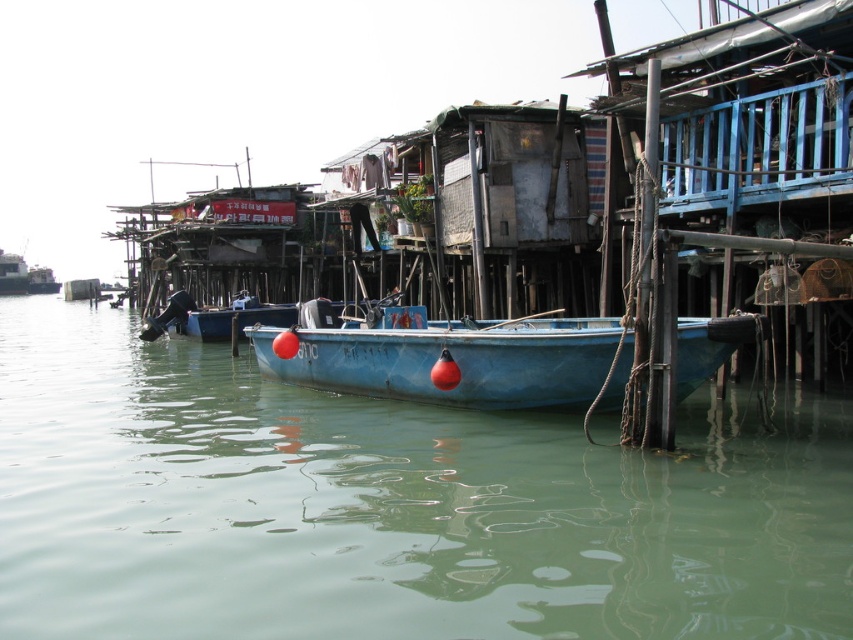
Question: Which object appears farthest from the camera in this image?

Choices:
 (A) green matte water at center
 (B) blue matte boat at center

Answer: (B)

Question: Which point is closer to the camera taking this photo?

Choices:
 (A) (685, 360)
 (B) (764, 566)

Answer: (B)

Question: Does green matte water at center have a greater width compared to blue matte boat at center?

Choices:
 (A) yes
 (B) no

Answer: (A)

Question: Which point is farther from the camera taking this photo?

Choices:
 (A) (413, 348)
 (B) (99, 589)

Answer: (A)

Question: Is green matte water at center above blue matte boat at center?

Choices:
 (A) yes
 (B) no

Answer: (B)

Question: From the image, what is the correct spatial relationship of green matte water at center in relation to blue matte boat at center?

Choices:
 (A) above
 (B) below

Answer: (B)